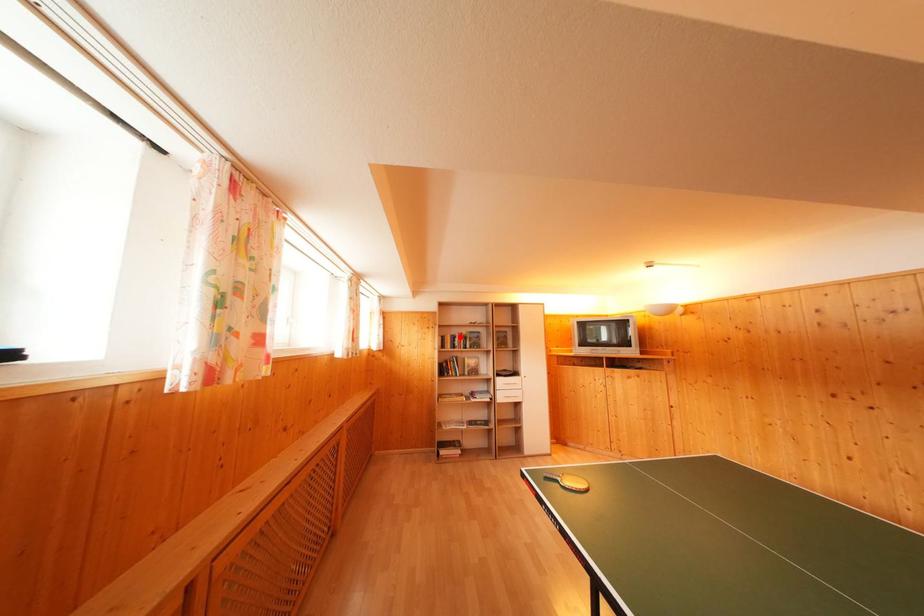
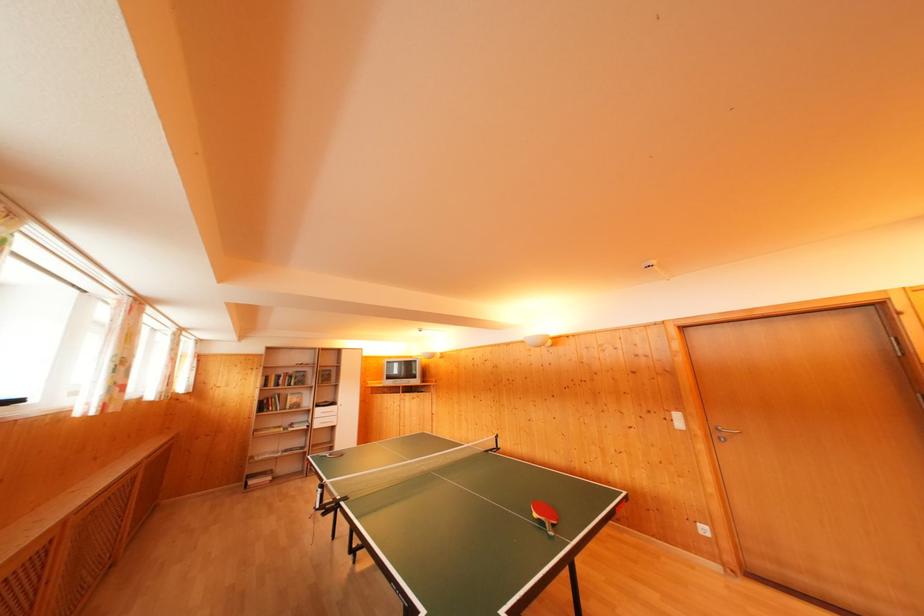
Locate, in the second image, the point that corresponds to the highlighted location in the first image.

(286, 377)